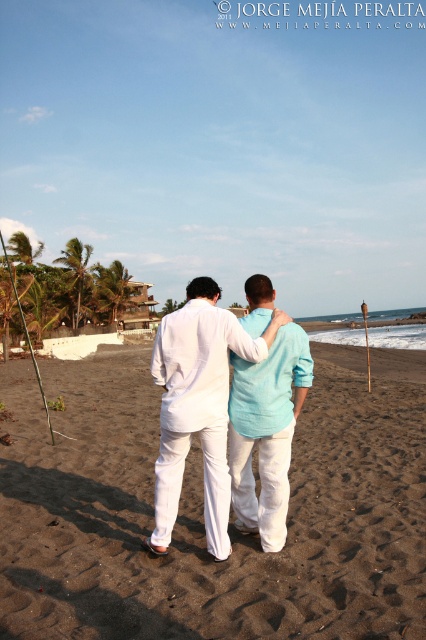
Is sandy beach at center taller than light blue linen shirt at center?

In fact, sandy beach at center may be shorter than light blue linen shirt at center.

Does sandy beach at center have a lesser height compared to light blue linen shirt at center?

Correct, sandy beach at center is not as tall as light blue linen shirt at center.

The height and width of the screenshot is (640, 426). Find the location of `sandy beach at center`. sandy beach at center is located at coordinates (201, 512).

The height and width of the screenshot is (640, 426). Describe the element at coordinates (201, 512) in the screenshot. I see `sandy beach at center` at that location.

Image resolution: width=426 pixels, height=640 pixels. In order to click on sandy beach at center in this screenshot , I will do (x=201, y=512).

Where is `sandy beach at center`? The height and width of the screenshot is (640, 426). sandy beach at center is located at coordinates (201, 512).

Does white linen shirt at center have a smaller size compared to light blue linen shirt at center?

No.

Does white linen shirt at center have a lesser width compared to light blue linen shirt at center?

In fact, white linen shirt at center might be wider than light blue linen shirt at center.

Identify the location of white linen shirt at center. (198, 404).